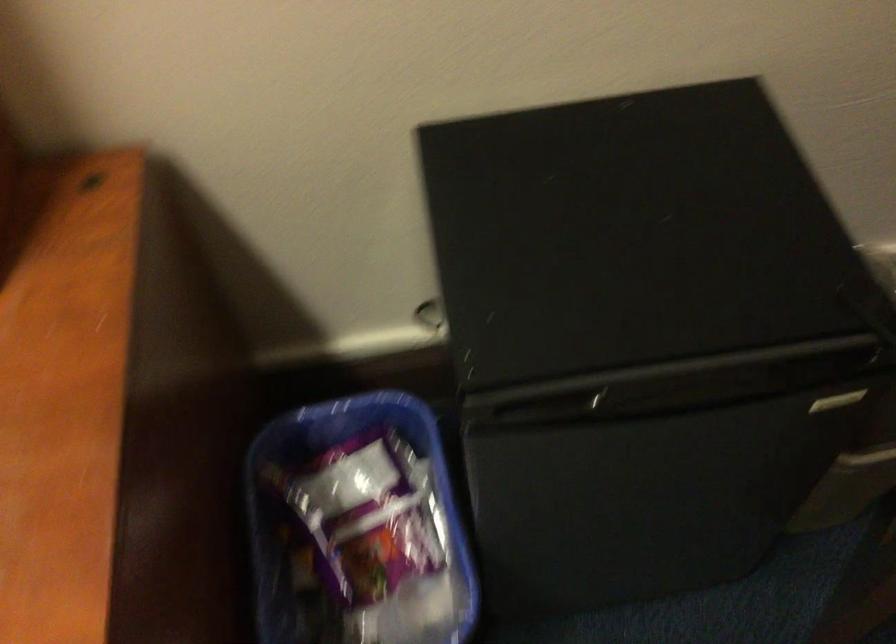
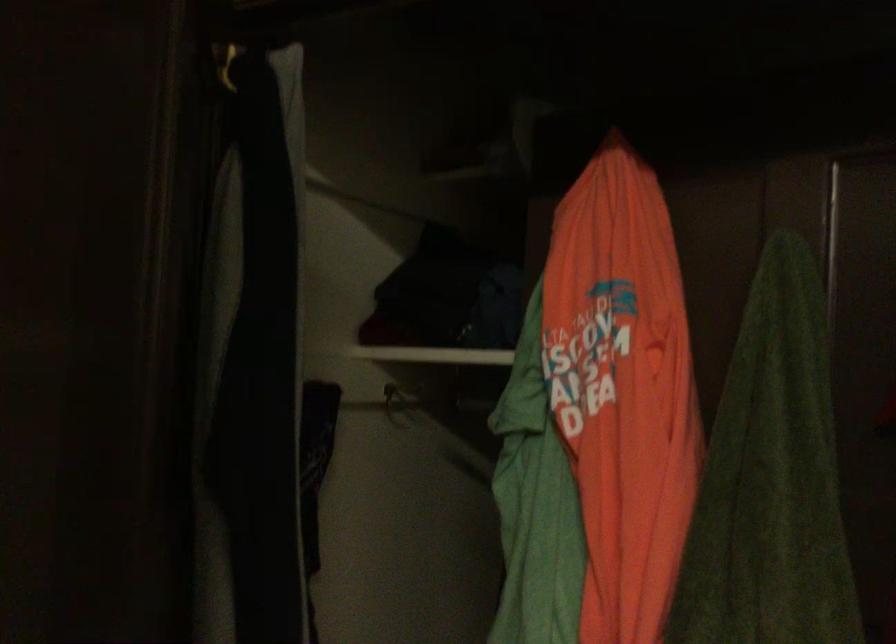
Based on the continuous images, in which direction is the camera rotating?

The rotation direction of the camera is right-up.